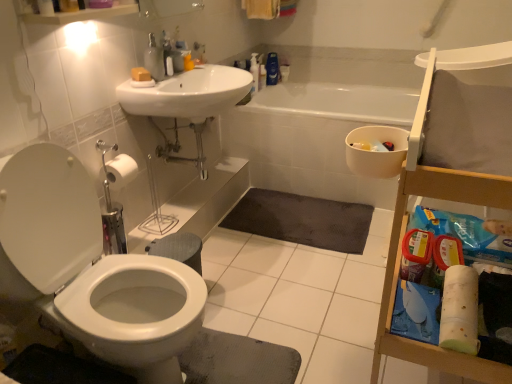
Question: Is dark gray textured bath mat at center at the back of metallic silver pipes at center?

Choices:
 (A) yes
 (B) no

Answer: (B)

Question: Is metallic silver pipes at center taller than dark gray textured bath mat at center?

Choices:
 (A) no
 (B) yes

Answer: (B)

Question: Is metallic silver pipes at center smaller than dark gray textured bath mat at center?

Choices:
 (A) yes
 (B) no

Answer: (B)

Question: From the image's perspective, would you say metallic silver pipes at center is positioned over dark gray textured bath mat at center?

Choices:
 (A) yes
 (B) no

Answer: (A)

Question: Is the depth of metallic silver pipes at center less than that of dark gray textured bath mat at center?

Choices:
 (A) no
 (B) yes

Answer: (B)

Question: From the image's perspective, is yellow matte soap at upper center positioned above or below translucent plastic soap dispenser at upper center, marked as the first toiletry in a front-to-back arrangement?

Choices:
 (A) below
 (B) above

Answer: (A)

Question: Is yellow matte soap at upper center in front of or behind translucent plastic soap dispenser at upper center, positioned as the 2th toiletry in right-to-left order, in the image?

Choices:
 (A) front
 (B) behind

Answer: (A)

Question: From their relative heights in the image, would you say yellow matte soap at upper center is taller or shorter than translucent plastic soap dispenser at upper center, which is the 1th toiletry in left-to-right order?

Choices:
 (A) tall
 (B) short

Answer: (B)

Question: Is yellow matte soap at upper center wider or thinner than translucent plastic soap dispenser at upper center, marked as the first toiletry in a front-to-back arrangement?

Choices:
 (A) thin
 (B) wide

Answer: (A)

Question: In terms of size, does yellow matte soap at upper center appear bigger or smaller than white glossy sink at upper center?

Choices:
 (A) big
 (B) small

Answer: (B)

Question: In the image, is yellow matte soap at upper center on the left side or the right side of white glossy sink at upper center?

Choices:
 (A) left
 (B) right

Answer: (A)

Question: Is point (141, 69) positioned closer to the camera than point (165, 105)?

Choices:
 (A) closer
 (B) farther

Answer: (B)

Question: From the image's perspective, is yellow matte soap at upper center above or below white glossy sink at upper center?

Choices:
 (A) below
 (B) above

Answer: (B)

Question: From the image's perspective, is white glossy toilet at left above or below white glossy sink at upper center?

Choices:
 (A) above
 (B) below

Answer: (B)

Question: Is white glossy toilet at left spatially inside white glossy sink at upper center, or outside of it?

Choices:
 (A) outside
 (B) inside

Answer: (A)